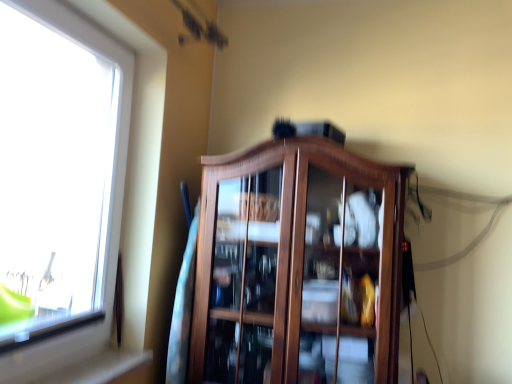
This screenshot has height=384, width=512. In order to click on vacant area on top of transparent glass window at left (from a real-world perspective) in this screenshot , I will do `click(102, 23)`.